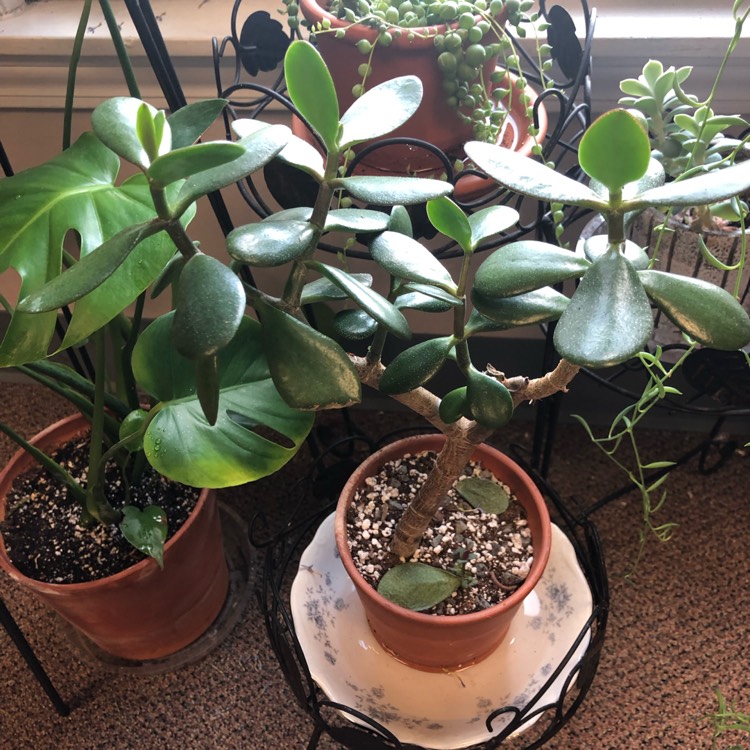
I want to click on black pot protector, so click(544, 720), click(373, 733), click(306, 699).